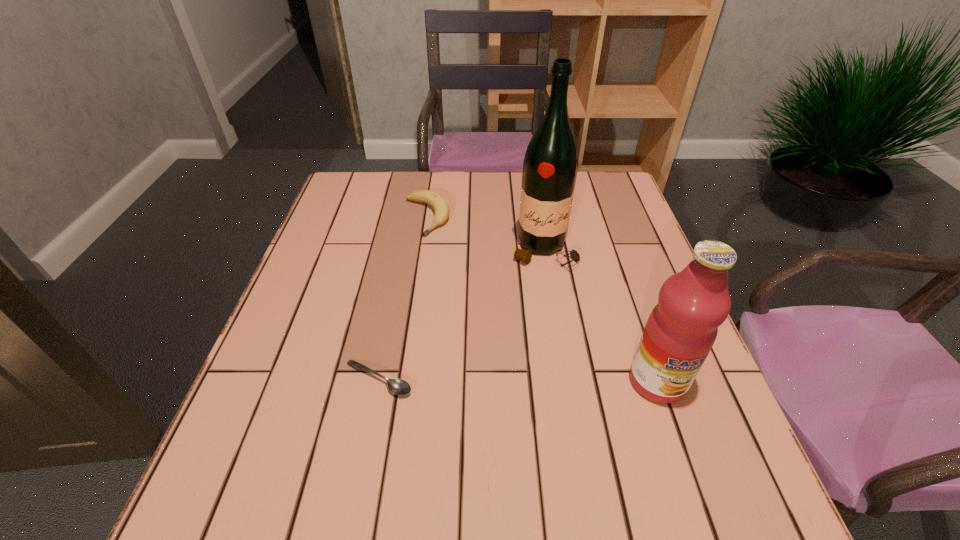
The image size is (960, 540). What are the coordinates of `free point between the second shortest object and the fruit juice` in the screenshot? It's located at (542, 299).

Where is `object that is the third closest to the wine bottle`? Image resolution: width=960 pixels, height=540 pixels. object that is the third closest to the wine bottle is located at coordinates (396, 386).

Locate an element on the screen. This screenshot has height=540, width=960. object that stands as the second closest to the soupspoon is located at coordinates (437, 201).

I want to click on vacant region that satisfies the following two spatial constraints: 1. on the back side of the soupspoon; 2. on the left side of the banana, so click(411, 217).